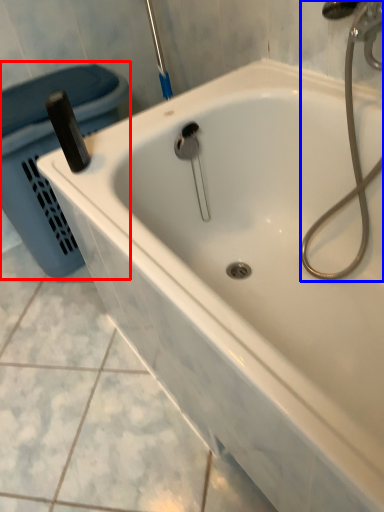
Question: Which point is further to the camera, laundry basket (highlighted by a red box) or plumbing fixture (highlighted by a blue box)?

Choices:
 (A) laundry basket
 (B) plumbing fixture

Answer: (A)